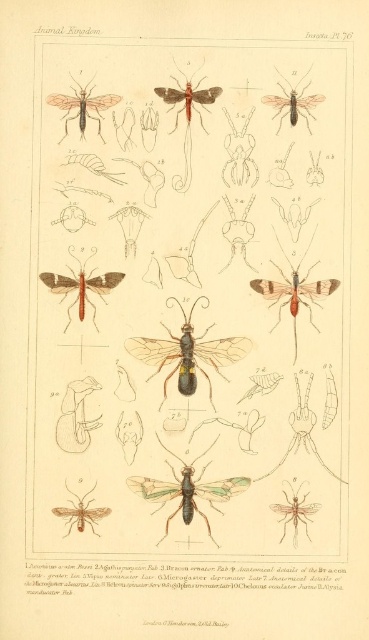
Is matte brown moth at center in front of translucent brown insect at upper right?

No, it is not.

Which is in front, point (53, 284) or point (308, 125)?

Point (308, 125) is in front.

Looking at this image, measure the distance between point (81, 291) and camera.

The distance of point (81, 291) from camera is 4.68 feet.

At what (x,y) coordinates should I click in order to perform the action: click on matte brown moth at center. Please return your answer as a coordinate pair (x, y). This screenshot has width=369, height=640. Looking at the image, I should click on (81, 285).

Which is below, green translucent wings at center or translucent yellowish-green insect at lower left?

translucent yellowish-green insect at lower left is below.

Locate an element on the screen. The image size is (369, 640). green translucent wings at center is located at coordinates (187, 490).

Between point (166, 522) and point (91, 528), which one is positioned behind?

The point (166, 522) is behind.

Locate an element on the screen. This screenshot has width=369, height=640. green translucent wings at center is located at coordinates (187, 490).

Identify the location of translucent green insect at center. The height and width of the screenshot is (640, 369). (191, 300).

Can you confirm if translucent green insect at center is smaller than translucent yellowish-green insect at lower left?

No, translucent green insect at center is not smaller than translucent yellowish-green insect at lower left.

Find the location of a particular element. translucent green insect at center is located at coordinates (191, 300).